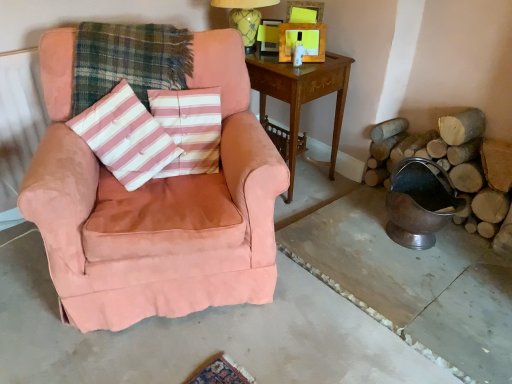
Question: Is wooden side table at center to the left of pink striped fabric pillow at center from the viewer's perspective?

Choices:
 (A) no
 (B) yes

Answer: (A)

Question: Can you confirm if wooden side table at center is thinner than pink striped fabric pillow at center?

Choices:
 (A) yes
 (B) no

Answer: (B)

Question: From the image's perspective, is wooden side table at center located beneath pink striped fabric pillow at center?

Choices:
 (A) no
 (B) yes

Answer: (A)

Question: Is wooden side table at center at the right side of pink striped fabric pillow at center?

Choices:
 (A) yes
 (B) no

Answer: (A)

Question: From a real-world perspective, is wooden side table at center located beneath pink striped fabric pillow at center?

Choices:
 (A) yes
 (B) no

Answer: (A)

Question: Looking at the image, does plaid fabric at center seem bigger or smaller compared to pink suede armchair at left?

Choices:
 (A) big
 (B) small

Answer: (B)

Question: Considering the positions of plaid fabric at center and pink suede armchair at left in the image, is plaid fabric at center wider or thinner than pink suede armchair at left?

Choices:
 (A) wide
 (B) thin

Answer: (B)

Question: Relative to pink suede armchair at left, is plaid fabric at center in front or behind?

Choices:
 (A) behind
 (B) front

Answer: (A)

Question: Is point (140, 46) closer or farther from the camera than point (320, 364)?

Choices:
 (A) closer
 (B) farther

Answer: (B)

Question: From the image's perspective, is wooden side table at center positioned above or below pink striped fabric pillow at center?

Choices:
 (A) below
 (B) above

Answer: (B)

Question: In the image, is wooden side table at center on the left side or the right side of pink striped fabric pillow at center?

Choices:
 (A) right
 (B) left

Answer: (A)

Question: Would you say wooden side table at center is inside or outside pink striped fabric pillow at center?

Choices:
 (A) inside
 (B) outside

Answer: (B)

Question: Is wooden side table at center taller or shorter than pink striped fabric pillow at center?

Choices:
 (A) tall
 (B) short

Answer: (A)

Question: Based on their sizes in the image, would you say natural wood logs at right is bigger or smaller than yellow glazed ceramic table lamp at upper center?

Choices:
 (A) small
 (B) big

Answer: (A)

Question: Is point (443, 117) closer or farther from the camera than point (253, 28)?

Choices:
 (A) farther
 (B) closer

Answer: (B)